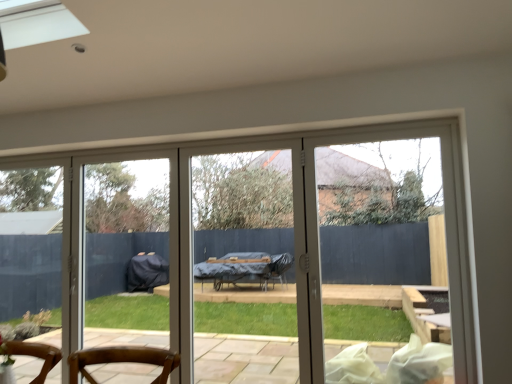
Question: Would you say clear glass screen door at center is outside white glossy door at center?

Choices:
 (A) yes
 (B) no

Answer: (A)

Question: Is clear glass screen door at center far away from white glossy door at center?

Choices:
 (A) no
 (B) yes

Answer: (B)

Question: From a real-world perspective, is clear glass screen door at center located beneath white glossy door at center?

Choices:
 (A) no
 (B) yes

Answer: (A)

Question: Can you confirm if clear glass screen door at center is bigger than white glossy door at center?

Choices:
 (A) yes
 (B) no

Answer: (B)

Question: From the image's perspective, is clear glass screen door at center above white glossy door at center?

Choices:
 (A) no
 (B) yes

Answer: (A)

Question: Can you confirm if clear glass screen door at center is wider than white glossy door at center?

Choices:
 (A) no
 (B) yes

Answer: (B)

Question: Is white glossy door at center positioned with its back to clear glass screen door at center?

Choices:
 (A) no
 (B) yes

Answer: (A)

Question: Is white glossy door at center oriented towards clear glass screen door at center?

Choices:
 (A) no
 (B) yes

Answer: (A)

Question: Is there a large distance between white glossy door at center and clear glass screen door at center?

Choices:
 (A) yes
 (B) no

Answer: (A)

Question: Considering the relative positions of white glossy door at center and clear glass screen door at center in the image provided, is white glossy door at center to the left of clear glass screen door at center from the viewer's perspective?

Choices:
 (A) no
 (B) yes

Answer: (A)

Question: Does white glossy door at center have a larger size compared to clear glass screen door at center?

Choices:
 (A) no
 (B) yes

Answer: (B)

Question: From the image's perspective, does white glossy door at center appear higher than clear glass screen door at center?

Choices:
 (A) yes
 (B) no

Answer: (A)

Question: From the image's perspective, relative to white glossy door at center, is clear glass screen door at center above or below?

Choices:
 (A) above
 (B) below

Answer: (B)